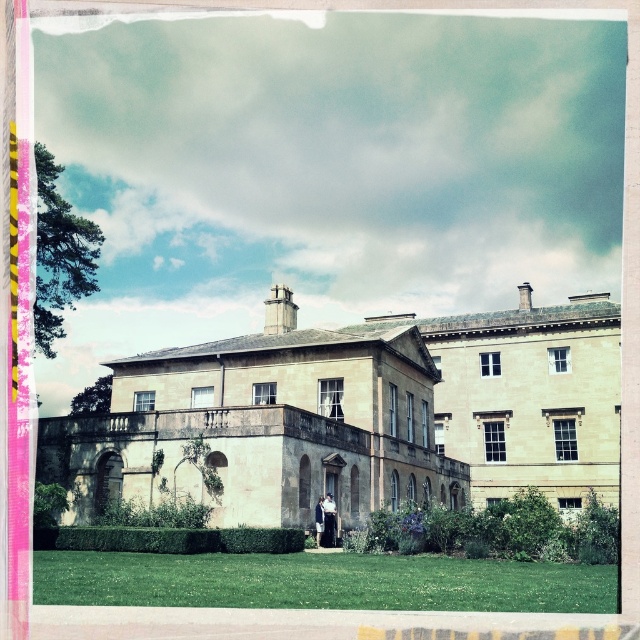
You are standing in the garden of the beige stone mansion at center and want to greet the person wearing the dark blue jacket at center. Which direction should you move to reach them?

The beige stone mansion at center is positioned on the right side of dark blue jacket at center, so you should move to your left to reach the person wearing the dark blue jacket at center.

You are a gardener who needs to mow the lawn. You see the green grass at lower center and the dark blue jacket at center. Which object is taller and requires immediate attention?

The green grass at lower center is taller than the dark blue jacket at center, so the gardener should mow the green grass at lower center first.

You are standing in the garden of the beige stone mansion at center and want to greet the person wearing the light blue fabric coat at center. Which direction should you walk to approach them?

The beige stone mansion at center is positioned on the right side of the light blue fabric coat at center, so you should walk to the left to approach the person wearing the light blue fabric coat at center.